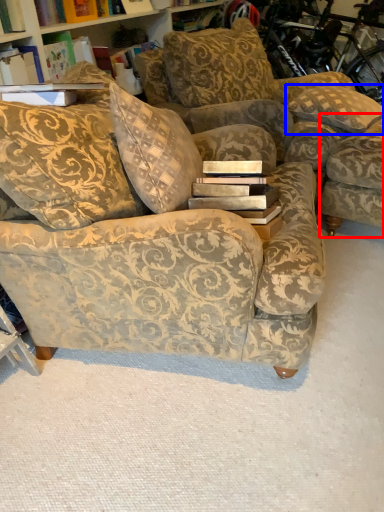
Question: Which of the following is the farthest to the observer, swivel chair (highlighted by a red box) or pillow (highlighted by a blue box)?

Choices:
 (A) swivel chair
 (B) pillow

Answer: (B)